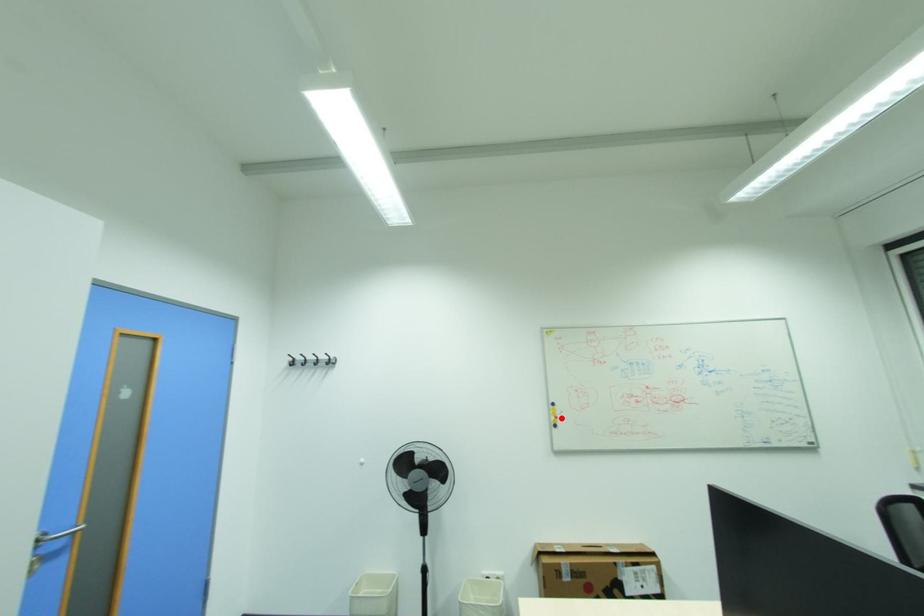
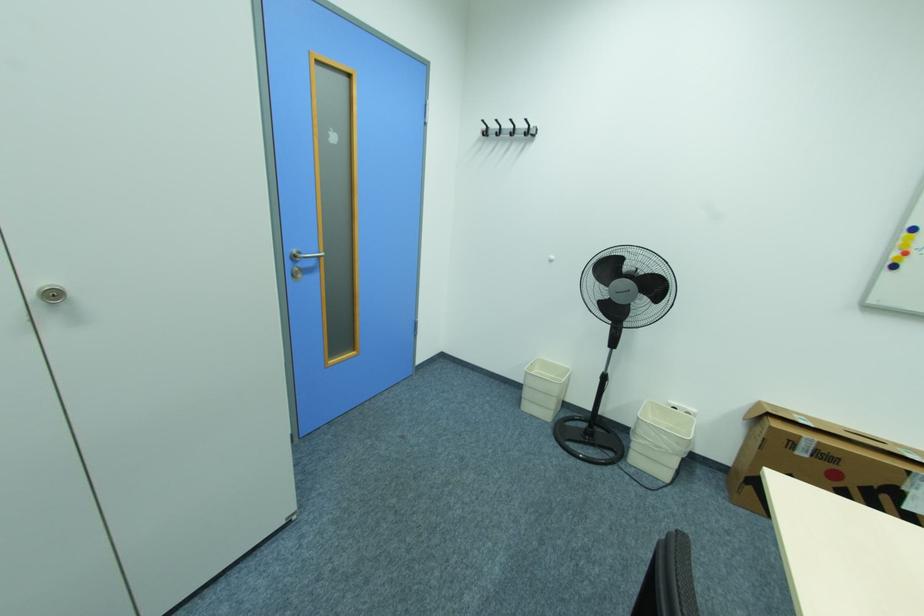
In the second image, find the point that corresponds to the highlighted location in the first image.

(910, 253)